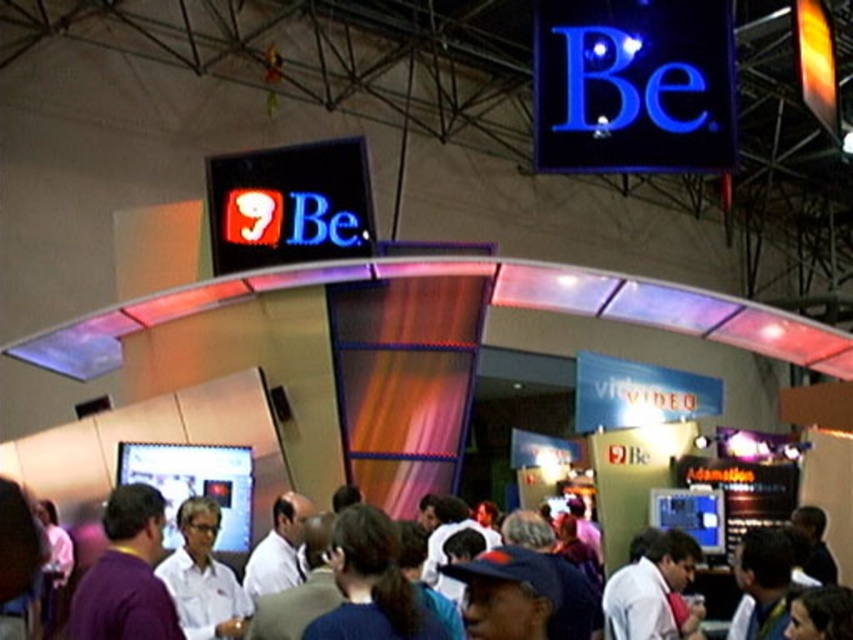
You are a GUI agent. You are given a task and a screenshot of the screen. Output one action in this format:
    pyautogui.click(x=<x>, y=<y>)
    Task: Click on the white shirt at center
    The width and height of the screenshot is (853, 640).
    Given the screenshot: What is the action you would take?
    click(138, 577)

Can you confirm if white shirt at center is thinner than white matte shirt at center?

Yes, white shirt at center is thinner than white matte shirt at center.

Image resolution: width=853 pixels, height=640 pixels. Identify the location of white shirt at center. coord(138,577).

The image size is (853, 640). Identify the location of white shirt at center. (138, 577).

Is purple shirt at lower left positioned in front of white matte shirt at center?

Yes, it is.

Is point (112, 540) behind point (236, 586)?

No.

This screenshot has width=853, height=640. I want to click on purple shirt at lower left, so (x=126, y=573).

Who is higher up, white matte shirt at center or white shirt at lower right?

white matte shirt at center is higher up.

Does white matte shirt at center lie behind white shirt at lower right?

No.

You are a GUI agent. You are given a task and a screenshot of the screen. Output one action in this format:
    pyautogui.click(x=<x>, y=<y>)
    Task: Click on the white matte shirt at center
    
    Given the screenshot: What is the action you would take?
    pyautogui.click(x=202, y=577)